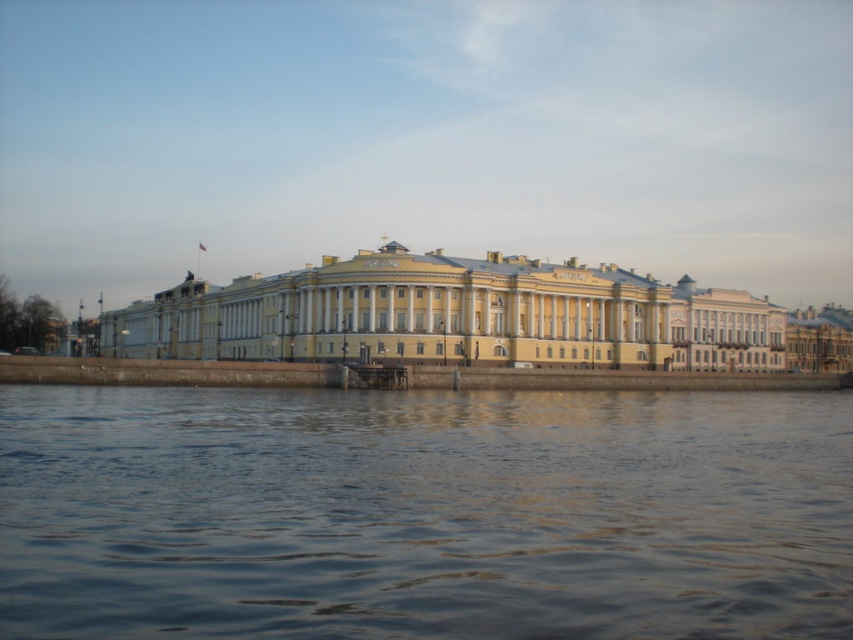
Based on the photo, you are a photographer planning to capture the yellow matte building at center from the blue water at lower center. Based on their positions, which direction should you move to get the building in your frame?

Since the blue water at lower center is positioned under the yellow matte building at center, you should move towards the water to position yourself where the blue water at lower center is located, allowing you to look upward to include the yellow matte building at center in your frame.

You are standing on a pier overlooking the blue water at lower center and the yellow matte building at center. Which object is closer to you based on your vantage point?

The blue water at lower center is closer to you because it is positioned in front of the yellow matte building at center.

You are standing on a pier and see the blue water at lower center and the yellow matte building at center. Which object is closer to your left side?

The blue water at lower center is positioned on the left side of yellow matte building at center, so it is closer to your left side.